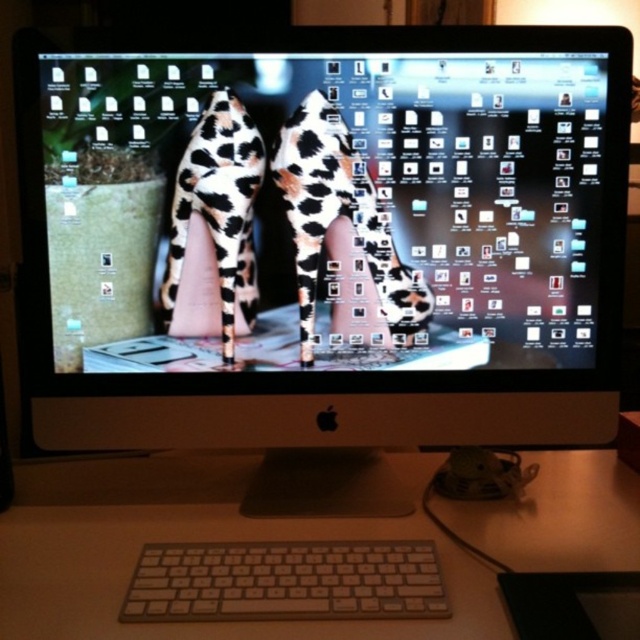
Question: Is white plastic keyboard at center above white plastic keyboard at lower center?

Choices:
 (A) no
 (B) yes

Answer: (B)

Question: Which point is farther to the camera?

Choices:
 (A) white plastic keyboard at center
 (B) cow print fabric shoe at center
 (C) white plastic keyboard at lower center

Answer: (B)

Question: Which object is farther from the camera taking this photo?

Choices:
 (A) white plastic keyboard at center
 (B) white plastic keyboard at lower center
 (C) matte plastic monitor at center

Answer: (C)

Question: Which point is farther from the camera taking this photo?

Choices:
 (A) (541, 42)
 (B) (611, 550)
 (C) (228, 598)
 (D) (241, 124)

Answer: (D)

Question: Where is matte plastic monitor at center located in relation to white plastic keyboard at center in the image?

Choices:
 (A) above
 (B) below

Answer: (A)

Question: Does matte plastic monitor at center appear on the right side of white plastic keyboard at center?

Choices:
 (A) no
 (B) yes

Answer: (A)